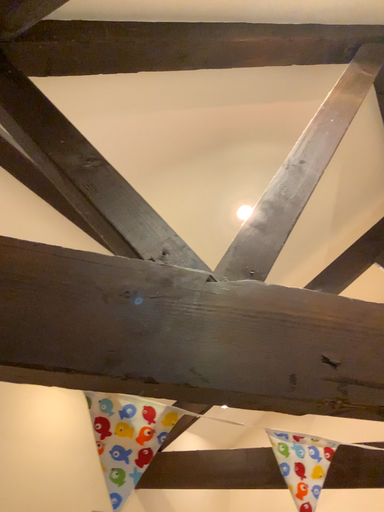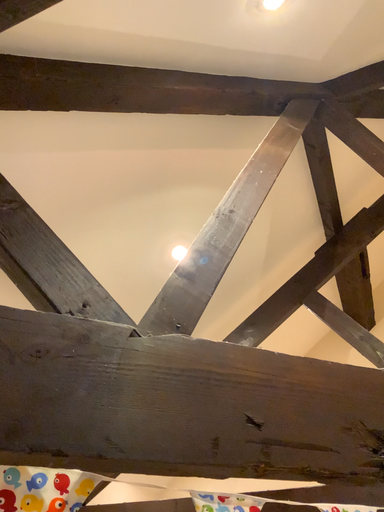
Question: Which way did the camera rotate in the video?

Choices:
 (A) rotated right
 (B) rotated left

Answer: (A)